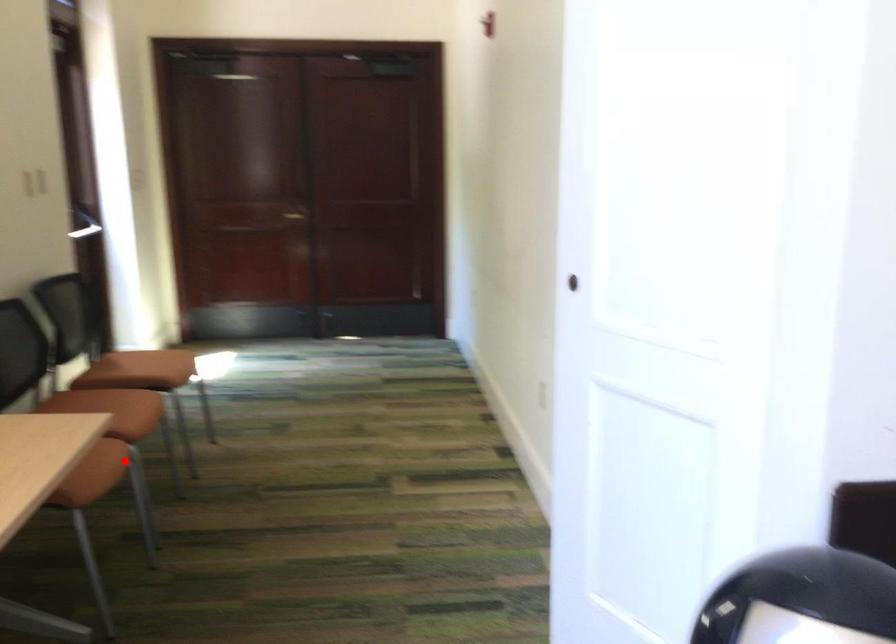
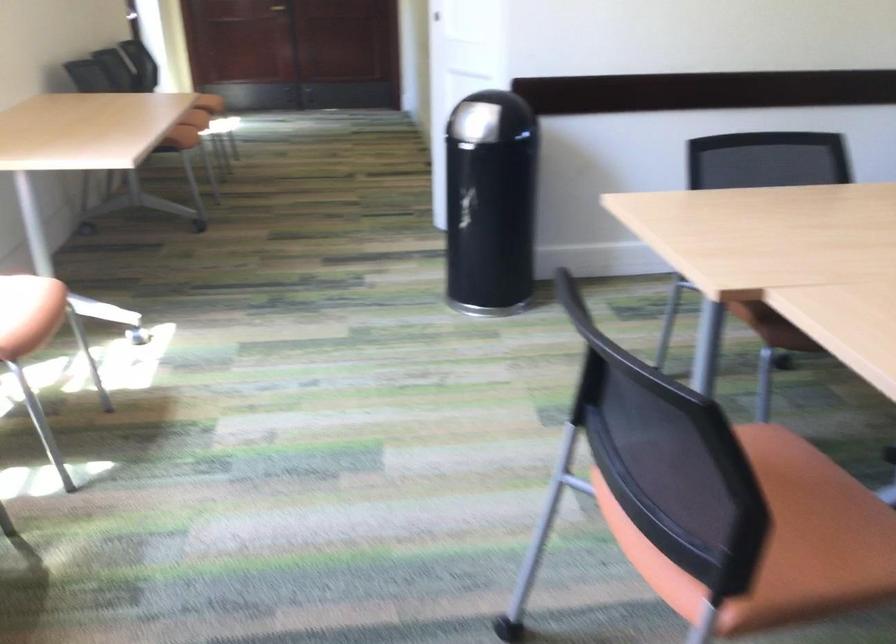
Question: I am providing you with two images of the same scene from different viewpoints. Given a red point in image1, look at the same physical point in image2. Is it:

Choices:
 (A) Closer to the viewpoint
 (B) Farther from the viewpoint

Answer: (B)